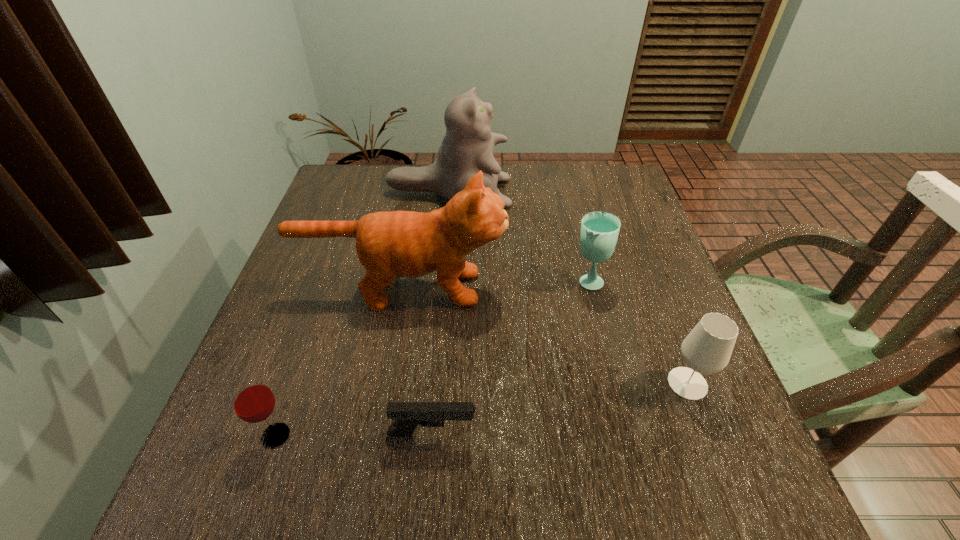
At what (x,y) coordinates should I click in order to perform the action: click on the farthest object. Please return your answer as a coordinate pair (x, y). The width and height of the screenshot is (960, 540). Looking at the image, I should click on (468, 146).

Where is `the nearer cat`? the nearer cat is located at coordinates pyautogui.click(x=407, y=244).

Locate an element on the screen. The image size is (960, 540). the second glass from left to right is located at coordinates (599, 232).

Find the location of `the farthest glass`. the farthest glass is located at coordinates (599, 232).

Image resolution: width=960 pixels, height=540 pixels. I want to click on the rightmost glass, so click(707, 349).

Identify the location of the second nearest glass. The image size is (960, 540). (707, 349).

This screenshot has height=540, width=960. In order to click on the nearest glass in this screenshot , I will do `click(252, 400)`.

Locate an element on the screen. The height and width of the screenshot is (540, 960). pistol is located at coordinates (408, 415).

Identify the location of vacant space located on the face of the farther cat. Image resolution: width=960 pixels, height=540 pixels. (568, 193).

This screenshot has width=960, height=540. What are the coordinates of `vacant region located on the face of the nearer cat` in the screenshot? It's located at click(627, 288).